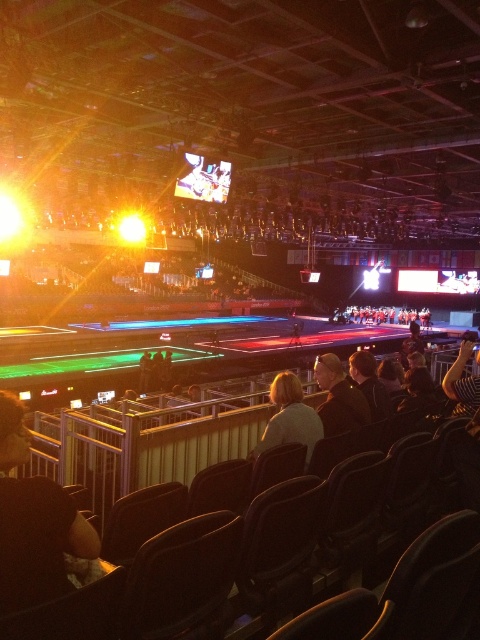
You are an athlete preparing to perform on the trampoline in the center of the arena. You notice two jackets hanging on the metal railing behind the stage. Which jacket is bigger in size between the light brown leather jacket at center and the black leather jacket at center?

The light brown leather jacket at center is larger in size compared to the black leather jacket at center.

You are standing in the sports arena and want to determine the relative positions of two points marked in the image. Which of the two points, point 1 at coordinates point (9, 522) or point 2 at coordinates point (336, 385), is closer to you?

Point 1 at coordinates point (9, 522) is closer to the viewer than point 2 at coordinates point (336, 385).

Looking at this image, you are a spectator sitting in the front row of the indoor sports arena. You notice two jackets hanging on the metal railing at center. Which jacket would you say is taller between the light brown leather jacket at center and the black leather jacket at center?

The light brown leather jacket at center is much taller than the black leather jacket at center.